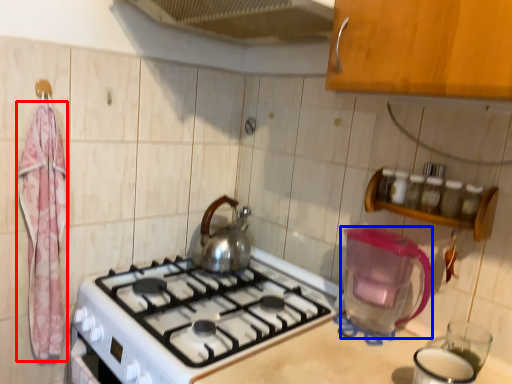
Question: Which object is closer to the camera taking this photo, bath towel (highlighted by a red box) or appliance (highlighted by a blue box)?

Choices:
 (A) bath towel
 (B) appliance

Answer: (B)